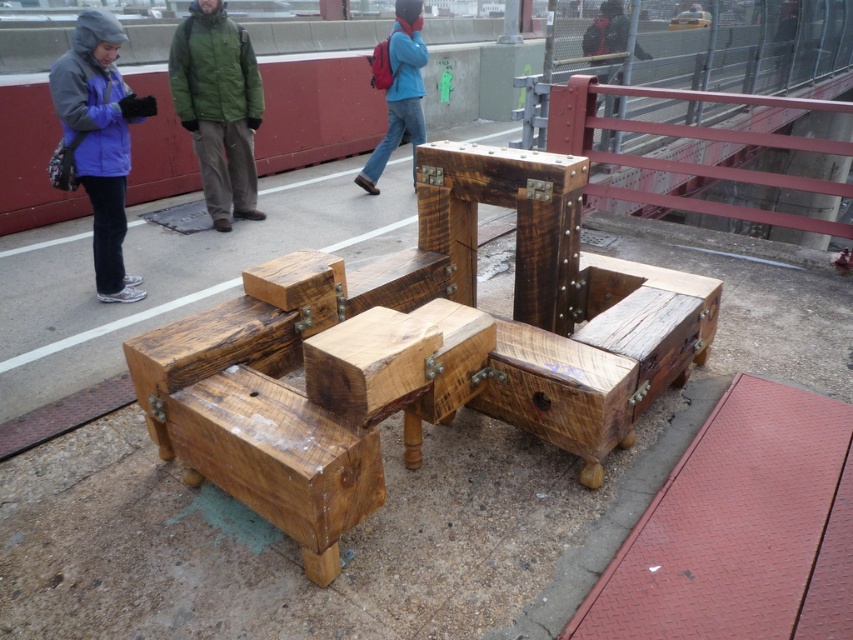
Question: Is weathered brown wood at center above dark brown wood at center?

Choices:
 (A) yes
 (B) no

Answer: (B)

Question: Is green woolen jacket at center to the left of dark gray jacket at upper left from the viewer's perspective?

Choices:
 (A) yes
 (B) no

Answer: (A)

Question: Which object is closer to the camera taking this photo?

Choices:
 (A) blue denim jeans at center
 (B) natural wood block at center
 (C) green woolen jacket at center
 (D) weathered brown wood at center

Answer: (D)

Question: Is natural wood block at center positioned in front of dark gray jacket at upper left?

Choices:
 (A) yes
 (B) no

Answer: (A)

Question: Estimate the real-world distances between objects in this image. Which object is farther from the natural wood block at center?

Choices:
 (A) smooth metal rail at upper right
 (B) purple fleece jacket at upper left
 (C) weathered brown wood at center
 (D) dark gray jacket at upper left

Answer: (D)

Question: Which object appears farthest from the camera in this image?

Choices:
 (A) purple fleece jacket at upper left
 (B) blue denim jeans at center
 (C) dark gray jacket at upper left
 (D) weathered brown wood at center

Answer: (C)